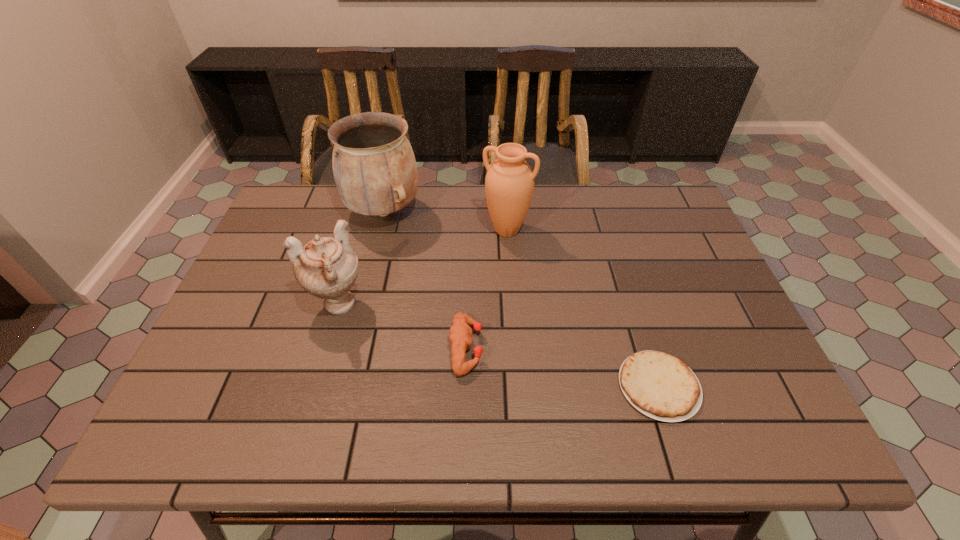
You are a GUI agent. You are given a task and a screenshot of the screen. Output one action in this format:
    pyautogui.click(x=<x>, y=<y>)
    Task: Click on the vacant space that satisfies the following two spatial constraints: 1. on the front side of the rightmost urn; 2. with the gloves of the puncher facing forward
    This screenshot has height=540, width=960.
    Given the screenshot: What is the action you would take?
    pyautogui.click(x=515, y=348)

Where is `free spot that satisfies the following two spatial constraints: 1. on the front side of the shortest object; 2. on the left side of the third shortest object`? free spot that satisfies the following two spatial constraints: 1. on the front side of the shortest object; 2. on the left side of the third shortest object is located at coordinates (314, 386).

Find the location of a particular element. Image resolution: width=960 pixels, height=540 pixels. vacant area that satisfies the following two spatial constraints: 1. on the back side of the shortest urn; 2. on the right side of the second object from right to left is located at coordinates (360, 231).